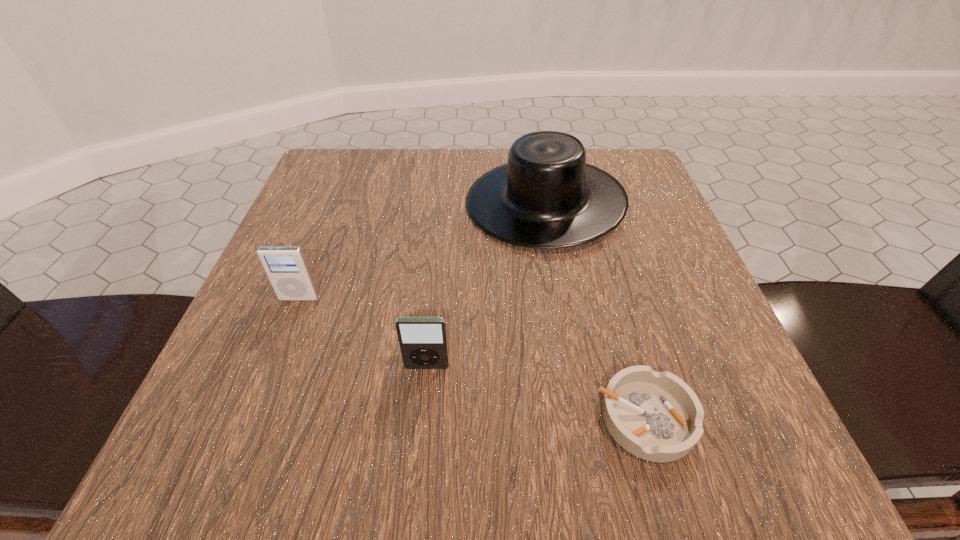
Identify the location of vacant region at the near edge of the desktop. tap(369, 423).

Locate an element on the screen. The image size is (960, 540). free space at the left edge of the desktop is located at coordinates (280, 338).

Where is `free space at the right edge`? This screenshot has width=960, height=540. free space at the right edge is located at coordinates (706, 327).

At what (x,y) coordinates should I click in order to perform the action: click on blank space at the far left corner. Please return your answer as a coordinate pair (x, y). Image resolution: width=960 pixels, height=540 pixels. Looking at the image, I should click on (359, 149).

The width and height of the screenshot is (960, 540). In the image, there is a desktop. Find the location of `vacant area at the near left corner`. vacant area at the near left corner is located at coordinates (175, 451).

Locate an element on the screen. free space that is in between the leftmost object and the right iPod is located at coordinates (363, 333).

Locate an element on the screen. free area in between the farthest object and the right iPod is located at coordinates (486, 285).

Locate an element on the screen. The height and width of the screenshot is (540, 960). vacant area between the ashtray and the tallest object is located at coordinates pyautogui.click(x=595, y=310).

You are a GUI agent. You are given a task and a screenshot of the screen. Output one action in this format:
    pyautogui.click(x=<x>, y=<y>)
    Task: Click on the free space that is in between the left iPod and the third object from right to left
    Image resolution: width=960 pixels, height=540 pixels.
    Given the screenshot: What is the action you would take?
    pyautogui.click(x=363, y=333)

Locate an element on the screen. vacant area that lies between the third nearest object and the nearer iPod is located at coordinates (363, 333).